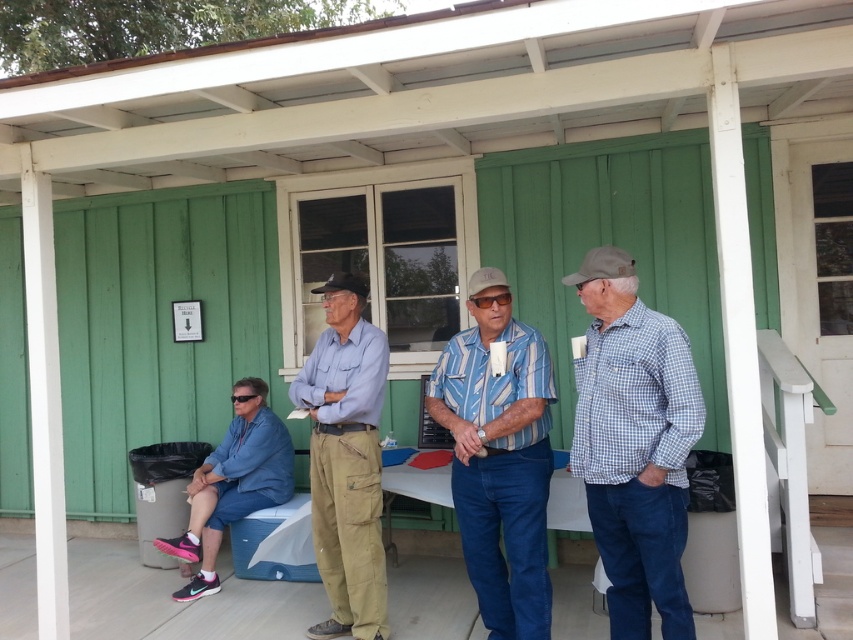
Is white checkered shirt at right taller than blue striped shirt at center?

No, white checkered shirt at right is not taller than blue striped shirt at center.

Between point (627, 545) and point (502, 294), which one is positioned in front?

Positioned in front is point (627, 545).

Locate an element on the screen. white checkered shirt at right is located at coordinates (634, 444).

Can you confirm if white checkered shirt at right is thinner than blue denim shorts at lower left?

Yes, white checkered shirt at right is thinner than blue denim shorts at lower left.

Which is behind, point (627, 371) or point (198, 508)?

The point (198, 508) is behind.

Image resolution: width=853 pixels, height=640 pixels. What do you see at coordinates (634, 444) in the screenshot?
I see `white checkered shirt at right` at bounding box center [634, 444].

Identify the location of white checkered shirt at right. This screenshot has width=853, height=640. (634, 444).

Can you confirm if matte blue shirt at center is positioned to the right of blue denim shorts at lower left?

Yes, matte blue shirt at center is to the right of blue denim shorts at lower left.

Between matte blue shirt at center and blue denim shorts at lower left, which one is positioned higher?

matte blue shirt at center is higher up.

Between point (343, 310) and point (173, 556), which one is positioned behind?

Point (173, 556)

The image size is (853, 640). What are the coordinates of `matte blue shirt at center` in the screenshot? It's located at (346, 460).